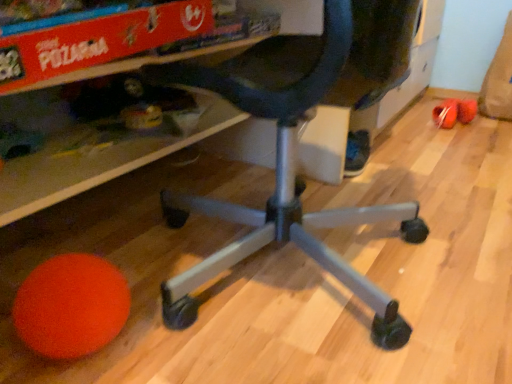
This screenshot has height=384, width=512. Find the location of `unoccupied area behind orange matte ball at lower left`. unoccupied area behind orange matte ball at lower left is located at coordinates coord(136,270).